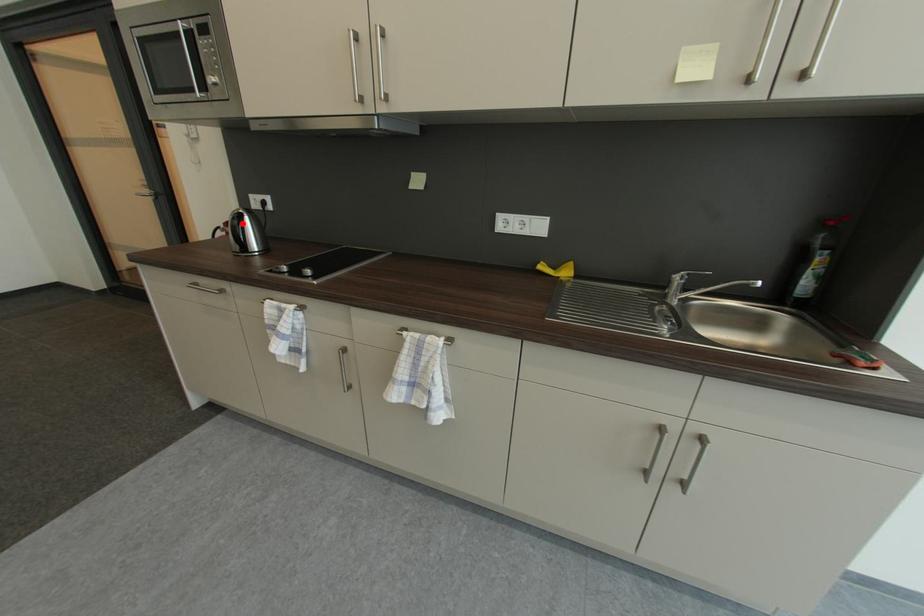
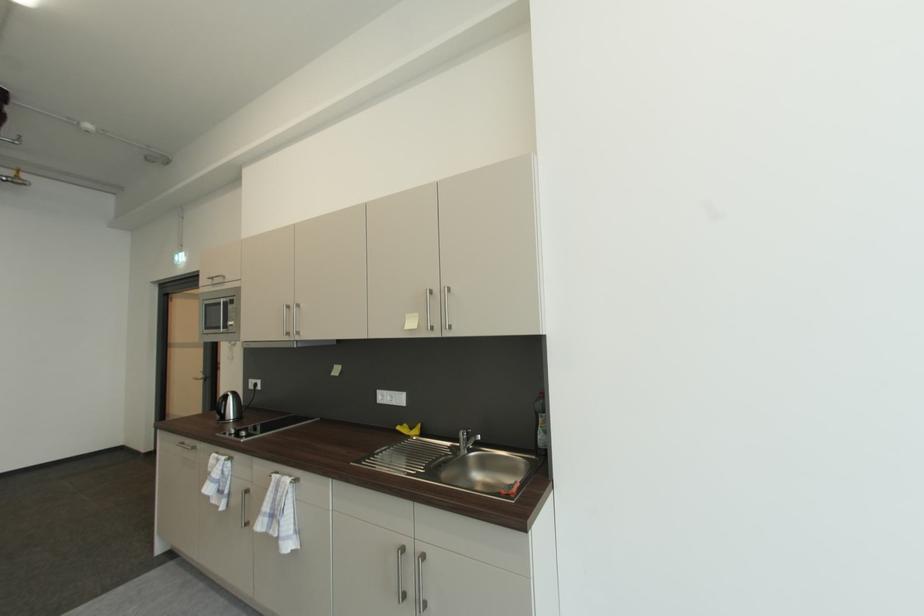
Find the pixel in the second image that matches the highlighted location in the first image.

(227, 402)